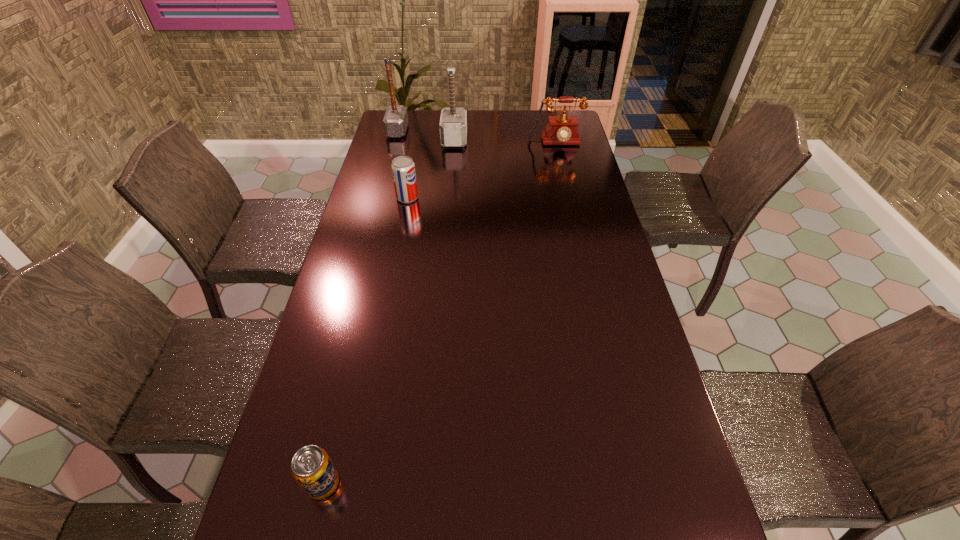
The width and height of the screenshot is (960, 540). In order to click on free spot between the nearer soda can and the farther soda can in this screenshot , I will do [x=365, y=341].

Where is `unoccupied position between the left hammer and the right hammer`? unoccupied position between the left hammer and the right hammer is located at coordinates (426, 135).

At what (x,y) coordinates should I click in order to perform the action: click on vacant area that lies between the third tallest object and the second shortest object. Please return your answer as a coordinate pair (x, y). This screenshot has height=540, width=960. Looking at the image, I should click on (481, 171).

Where is `free area in between the right hammer and the left hammer`? This screenshot has height=540, width=960. free area in between the right hammer and the left hammer is located at coordinates click(x=426, y=135).

Identify the location of empty location between the nearer soda can and the taller soda can. (365, 341).

You are a GUI agent. You are given a task and a screenshot of the screen. Output one action in this format:
    pyautogui.click(x=<x>, y=<y>)
    Task: Click on the free spot between the left hammer and the shortest object
    The height and width of the screenshot is (540, 960).
    Given the screenshot: What is the action you would take?
    pyautogui.click(x=360, y=307)

This screenshot has width=960, height=540. Identify the location of free space between the left hammer and the fourth object from left to right. (426, 135).

Locate an element on the screen. The height and width of the screenshot is (540, 960). object that is the third closest to the left hammer is located at coordinates (561, 130).

Locate which object is the third closest to the second object from right to left. Please provide its 2D coordinates. Your answer should be formatted as a tuple, i.e. [(x, y)], where the tuple contains the x and y coordinates of a point satisfying the conditions above.

[(403, 168)]

Identify the location of free region that satisfies the following two spatial constraints: 1. on the striking surface of the left hammer; 2. on the right side of the nearest object. (303, 483).